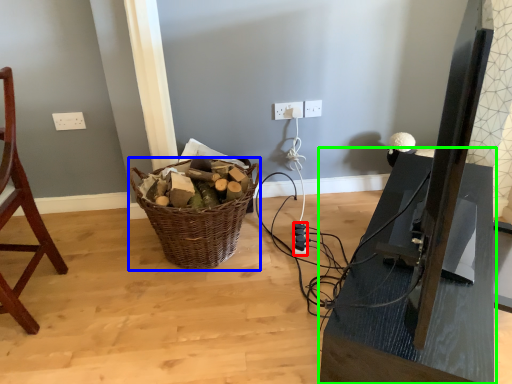
Question: Which object is the closest to the extension cord (highlighted by a red box)? Choose among these: basket (highlighted by a blue box) or table (highlighted by a green box).

Choices:
 (A) basket
 (B) table

Answer: (A)